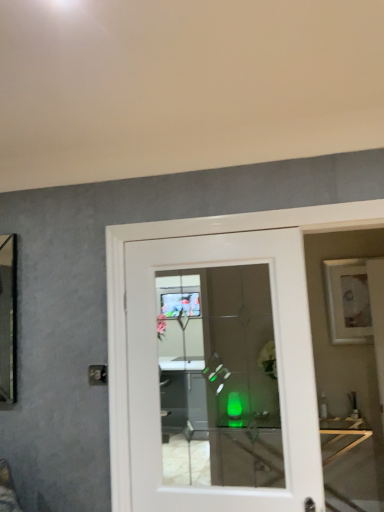
Question: Can you confirm if white glossy door at center is wider than translucent glass table at center?

Choices:
 (A) yes
 (B) no

Answer: (B)

Question: Considering the relative sizes of white glossy door at center and translucent glass table at center in the image provided, is white glossy door at center thinner than translucent glass table at center?

Choices:
 (A) yes
 (B) no

Answer: (A)

Question: Does white glossy door at center have a larger size compared to translucent glass table at center?

Choices:
 (A) yes
 (B) no

Answer: (B)

Question: From a real-world perspective, is white glossy door at center beneath translucent glass table at center?

Choices:
 (A) no
 (B) yes

Answer: (A)

Question: Is white glossy door at center turned away from translucent glass table at center?

Choices:
 (A) yes
 (B) no

Answer: (A)

Question: From the image's perspective, does white glossy door at center appear lower than translucent glass table at center?

Choices:
 (A) no
 (B) yes

Answer: (A)

Question: Can you confirm if translucent glass table at center is taller than white glossy door at center?

Choices:
 (A) yes
 (B) no

Answer: (B)

Question: Does translucent glass table at center come in front of white glossy door at center?

Choices:
 (A) no
 (B) yes

Answer: (A)

Question: Would you say translucent glass table at center is a long distance from white glossy door at center?

Choices:
 (A) no
 (B) yes

Answer: (B)

Question: Can you confirm if translucent glass table at center is bigger than white glossy door at center?

Choices:
 (A) no
 (B) yes

Answer: (B)

Question: Is translucent glass table at center not within white glossy door at center?

Choices:
 (A) no
 (B) yes

Answer: (B)

Question: Considering the relative sizes of translucent glass table at center and white glossy door at center in the image provided, is translucent glass table at center smaller than white glossy door at center?

Choices:
 (A) no
 (B) yes

Answer: (A)

Question: From the image's perspective, is white glossy door at center beneath white matte picture frame at upper right?

Choices:
 (A) yes
 (B) no

Answer: (A)